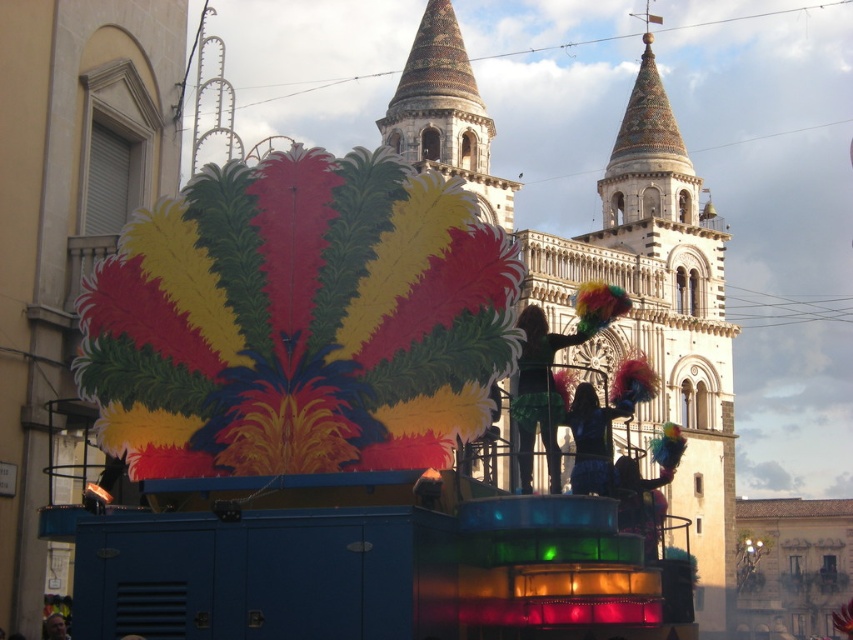
Who is shorter, speckled stone tower at center or smooth skin face at center?

Standing shorter between the two is smooth skin face at center.

Which is behind, point (468, 76) or point (62, 620)?

The point (468, 76) is more distant.

Does point (450, 20) come farther from viewer compared to point (54, 637)?

Yes, it is behind point (54, 637).

Locate an element on the screen. speckled stone tower at center is located at coordinates (445, 115).

Who is positioned more to the right, shiny metallic costume at center or smooth skin face at center?

Positioned to the right is shiny metallic costume at center.

Can you confirm if shiny metallic costume at center is wider than smooth skin face at center?

Yes.

Which is in front, point (579, 460) or point (64, 634)?

Point (579, 460) is in front.

You are a GUI agent. You are given a task and a screenshot of the screen. Output one action in this format:
    pyautogui.click(x=<x>, y=<y>)
    Task: Click on the shiny metallic costume at center
    This screenshot has height=640, width=853.
    Given the screenshot: What is the action you would take?
    pyautogui.click(x=593, y=440)

Describe the element at coordinates (552, 372) in the screenshot. I see `multicolored feathers at center` at that location.

Which is above, multicolored feathers at center or smooth skin face at center?

Positioned higher is multicolored feathers at center.

Who is more distant from viewer, (607,288) or (61,634)?

The point (607,288) is behind.

Where is `multicolored feathers at center`? This screenshot has width=853, height=640. multicolored feathers at center is located at coordinates (552, 372).